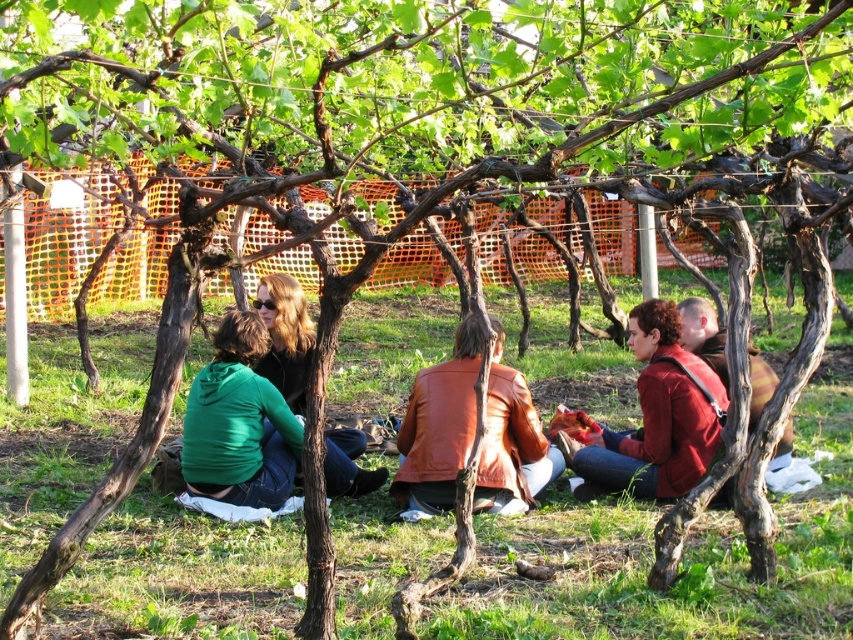
You are standing at the origin point of the coordinate system in the vineyard scene. You want to walk towards the point labeled as point (682, 492). Will you pass by the point labeled as point (717, 330) before reaching your destination?

Since point (682, 492) is in front of point (717, 330), you will not pass by point (717, 330) before reaching your destination.

You are planning to throw a small ball from the person wearing the green hoodie to the person in the matte red jacket at center. What is the minimum distance you need to throw the ball?

The minimum distance you need to throw the ball is 5.29 meters because the person wearing the green hoodie and the person in the matte red jacket at center are 5.29 meters apart.

You are planning to take a photo of the group under the grapevines. To ensure both the green matte jacket at lower left and the matte red jacket at center are visible in the frame, which jacket should you position closer to the camera?

The green matte jacket at lower left should be positioned closer to the camera because the matte red jacket at center is behind it, so moving the green matte jacket forward will keep both visible without one blocking the other.